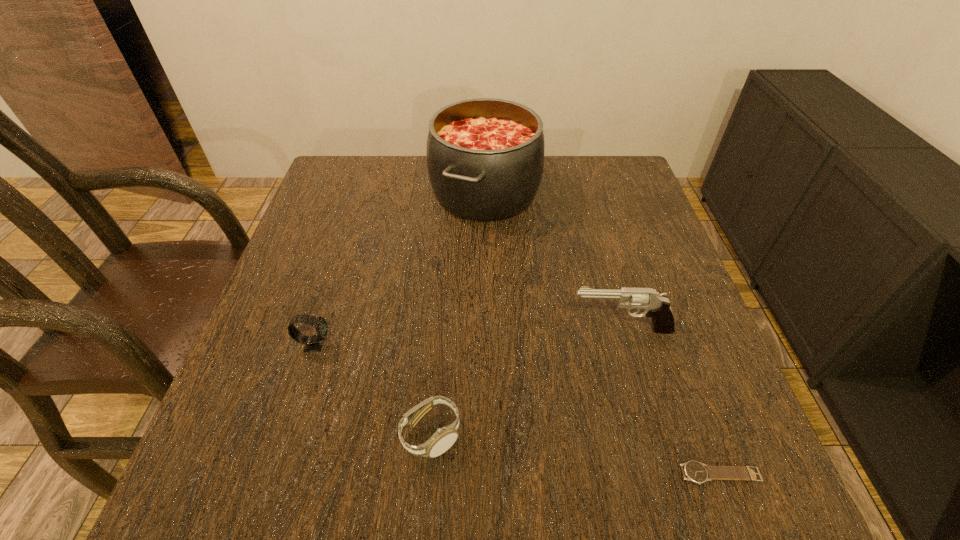
You are a GUI agent. You are given a task and a screenshot of the screen. Output one action in this format:
    pyautogui.click(x=<x>, y=<y>)
    Task: Click on the free point between the shortest object and the leftmost object
    The height and width of the screenshot is (540, 960).
    Given the screenshot: What is the action you would take?
    pyautogui.click(x=517, y=409)

This screenshot has width=960, height=540. I want to click on vacant area that lies between the farthest object and the leftmost object, so coord(400,268).

At what (x,y) coordinates should I click in order to perform the action: click on vacant area between the fourth nearest object and the shortest watch. Please return your answer as a coordinate pair (x, y). Image resolution: width=960 pixels, height=540 pixels. Looking at the image, I should click on (671, 401).

The width and height of the screenshot is (960, 540). In order to click on free point between the tallest object and the fourth tallest object in this screenshot , I will do `click(458, 314)`.

Image resolution: width=960 pixels, height=540 pixels. Identify the location of empty space that is in between the third farthest object and the shortest watch. (517, 409).

Find the location of a particular element. This screenshot has height=540, width=960. free area in between the second tallest watch and the fourth nearest object is located at coordinates (526, 382).

At what (x,y) coordinates should I click in order to perform the action: click on free area in between the rightmost watch and the second shortest object. Please return your answer as a coordinate pair (x, y). Looking at the image, I should click on (576, 454).

You are a GUI agent. You are given a task and a screenshot of the screen. Output one action in this format:
    pyautogui.click(x=<x>, y=<y>)
    Task: Click on the object that is the second closest one to the second shortest object
    The height and width of the screenshot is (540, 960).
    Given the screenshot: What is the action you would take?
    pyautogui.click(x=655, y=305)

Identify the location of object that is the closest one to the second watch from left to right. This screenshot has height=540, width=960. (313, 343).

Locate which watch ranks second in proximity to the third tallest object. Please provide its 2D coordinates. Your answer should be formatted as a tuple, i.e. [(x, y)], where the tuple contains the x and y coordinates of a point satisfying the conditions above.

[(694, 471)]